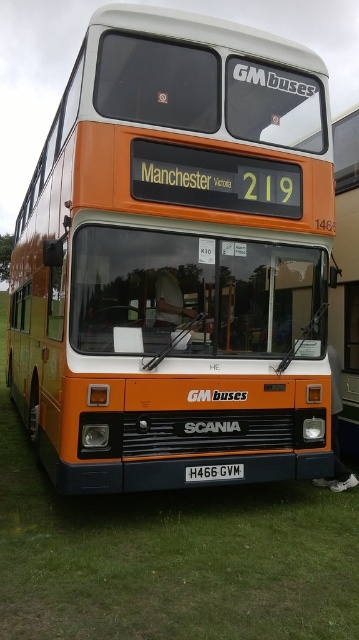
You are a delivery person trying to deliver a package to the orange matte bus at center. The license plate at center is required for verification. Can you reach the white rectangular license plate at center without getting too close to the bus?

The orange matte bus at center is 3.79 meters away from the white rectangular license plate at center. Since the distance is sufficient, you can easily reach the white rectangular license plate at center without getting too close to the bus.

You are a photographer trying to capture the orange matte bus at center and the white rectangular license plate at center in a single frame. Based on their sizes, which object should you focus on first to ensure both are clearly visible in your photo?

The orange matte bus at center is smaller than the white rectangular license plate at center, so you should focus on the white rectangular license plate at center first to ensure both are clearly visible in your photo.

You are standing in front of the orange matte bus at center and want to look at the white rectangular license plate at center. Which direction should you move to get a better view of the license plate?

You should move backward to get a better view of the white rectangular license plate at center because the orange matte bus at center is closer to you than the license plate, blocking your view.